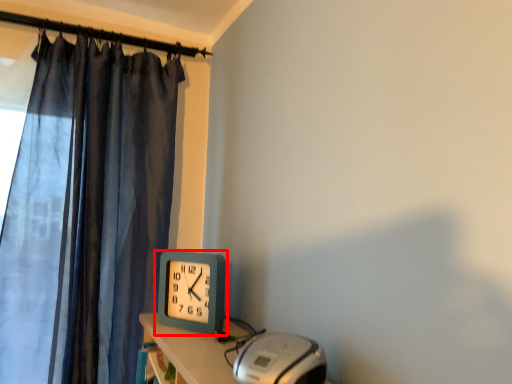
Question: Observing the image, what is the correct spatial positioning of wall clock (annotated by the red box) in reference to equipment?

Choices:
 (A) right
 (B) left

Answer: (B)